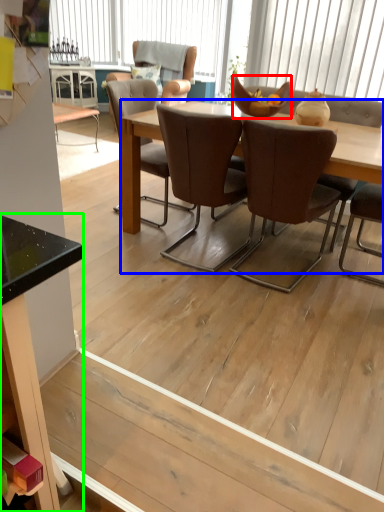
Question: Based on their relative distances, which object is nearer to bowl (highlighted by a red box)? Choose from kitchen & dining room table (highlighted by a blue box) and desk (highlighted by a green box).

Choices:
 (A) kitchen & dining room table
 (B) desk

Answer: (A)